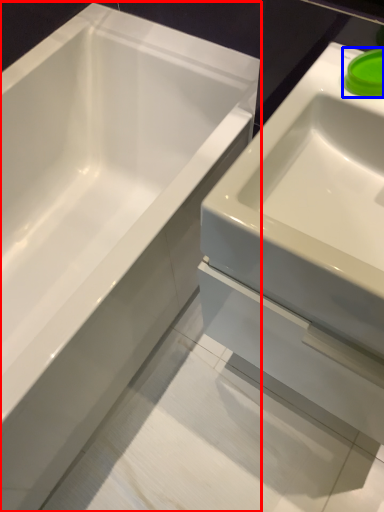
Question: Which of the following is the closest to the observer, bathtub (highlighted by a red box) or liquid (highlighted by a blue box)?

Choices:
 (A) bathtub
 (B) liquid

Answer: (A)